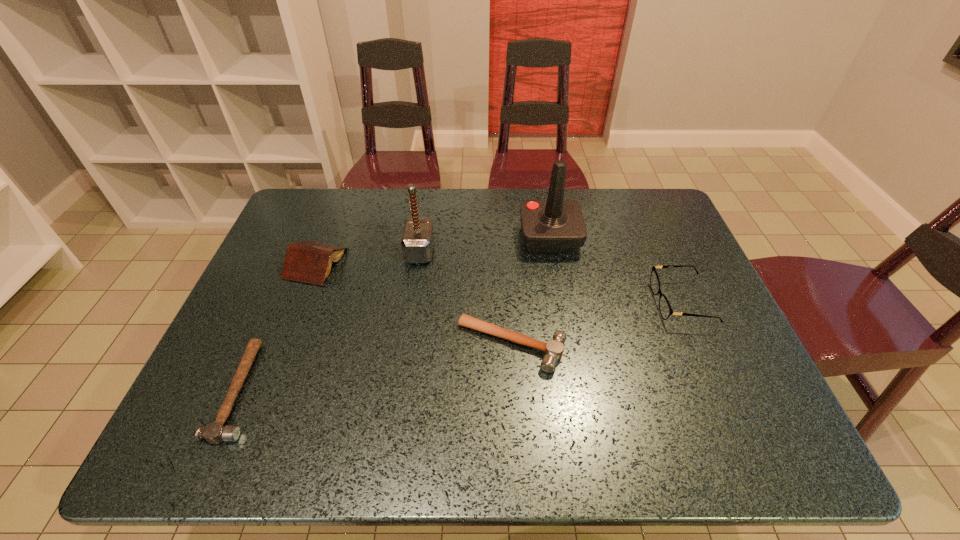
Find the location of a particular element. free spot located on the front of the book is located at coordinates (268, 388).

Locate an element on the screen. The height and width of the screenshot is (540, 960). free point located on the front-facing side of the rightmost object is located at coordinates (538, 302).

Where is `free location located 0.360m on the front-facing side of the rightmost object`? The image size is (960, 540). free location located 0.360m on the front-facing side of the rightmost object is located at coordinates (518, 302).

Locate an element on the screen. free point located on the front-facing side of the rightmost object is located at coordinates (602, 302).

What are the coordinates of `vacant space located 0.250m on the left of the rightmost hammer` in the screenshot? It's located at (353, 345).

Identify the location of free region located on the striking face of the leftmost hammer. (281, 390).

Where is `object present at the far edge`? object present at the far edge is located at coordinates (554, 225).

Image resolution: width=960 pixels, height=540 pixels. Find the location of `object at the near edge`. object at the near edge is located at coordinates (214, 433).

I want to click on book located at the left edge, so click(309, 261).

I want to click on hammer that is at the left edge, so click(x=214, y=433).